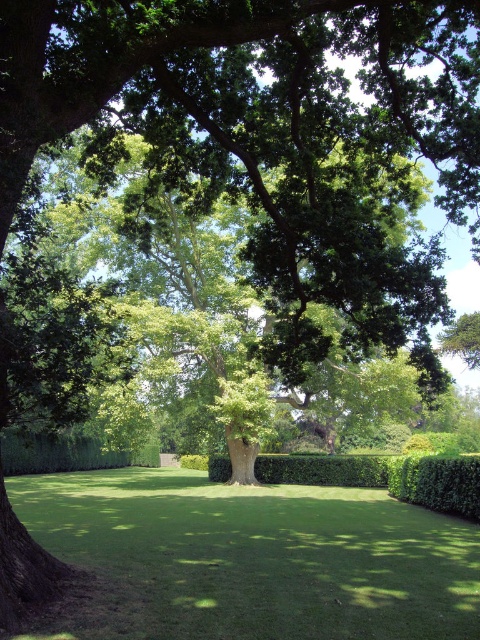
You are planning to place a 1.5 meter wide garden bench in this garden. Based on the scene, which object between the green grass at center and the green leafy hedge at lower right would allow the bench to fit without overlapping either of them?

The green grass at center has a larger width than the green leafy hedge at lower right. Since the bench is 1.5 meters wide, placing it on the green grass at center would provide enough space as its width is greater, ensuring the bench doesn not overlap either object.

You are standing at the center of the lawn in the garden scene. You want to walk towards the green leafy hedge at lower right. Which direction should you face to head directly towards it?

The green leafy hedge at lower right is located at point [436,483], so you should face towards the lower right direction to head directly towards it.